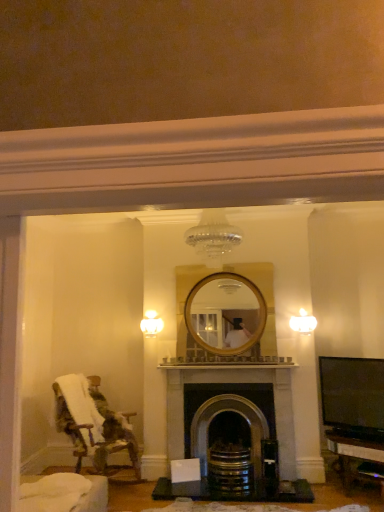
Question: Is dark gray stone fireplace at center in front of or behind fluffy fabric chair at left in the image?

Choices:
 (A) front
 (B) behind

Answer: (B)

Question: Is dark gray stone fireplace at center inside the boundaries of fluffy fabric chair at left, or outside?

Choices:
 (A) inside
 (B) outside

Answer: (B)

Question: Considering the real-world distances, which object is closest to the white glass light fixture at upper center, marked as the second light fixture in a right-to-left arrangement?

Choices:
 (A) white frosted glass sconce at upper right, placed as the second light fixture when sorted from left to right
 (B) fluffy fabric chair at left
 (C) dark gray stone fireplace at center

Answer: (C)

Question: Which object is positioned farthest from the fluffy fabric chair at left?

Choices:
 (A) white glass light fixture at upper center, marked as the 1th light fixture in a left-to-right arrangement
 (B) dark gray stone fireplace at center
 (C) white frosted glass sconce at upper right, which is counted as the first light fixture, starting from the right

Answer: (C)